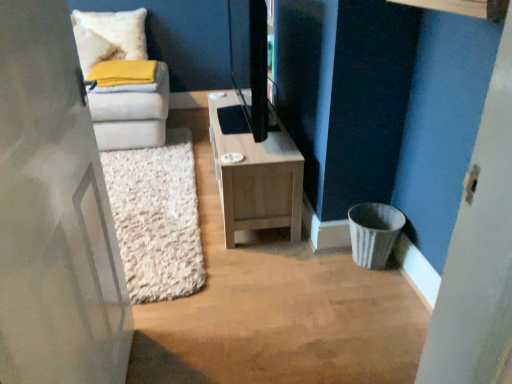
This screenshot has height=384, width=512. Describe the element at coordinates (157, 218) in the screenshot. I see `white shaggy rug at center` at that location.

Find the location of a particular element. white matte door at left is located at coordinates (54, 213).

Who is bigger, white soft pillow at upper left or white matte door at left?

white matte door at left.

Is white soft pillow at upper left not close to white matte door at left?

white soft pillow at upper left is far away from white matte door at left.

You are a GUI agent. You are given a task and a screenshot of the screen. Output one action in this format:
    pyautogui.click(x=<x>, y=<y>)
    Task: Click on the pillow lying on the left of white matte door at left
    This screenshot has height=384, width=512.
    Given the screenshot: What is the action you would take?
    pyautogui.click(x=94, y=49)

Is white soft pillow at upper left positioned with its back to white matte door at left?

No, white soft pillow at upper left is not facing away from white matte door at left.

Is light wood/texture tv stand at center taller or shorter than white shaggy rug at center?

Considering their sizes, light wood/texture tv stand at center has more height than white shaggy rug at center.

Is point (238, 150) farther from viewer compared to point (203, 262)?

Yes, it is.

Is the surface of light wood/texture tv stand at center in direct contact with white shaggy rug at center?

No, light wood/texture tv stand at center is not making contact with white shaggy rug at center.

Can you confirm if light wood/texture tv stand at center is wider than white shaggy rug at center?

In fact, light wood/texture tv stand at center might be narrower than white shaggy rug at center.

Consider the image. From a real-world perspective, does white matte door at left sit lower than white shaggy rug at center?

No, from a real-world perspective, white matte door at left is not under white shaggy rug at center.

Could you tell me if white matte door at left is turned towards white shaggy rug at center?

No, white matte door at left does not turn towards white shaggy rug at center.

Between white matte door at left and white shaggy rug at center, which one has larger width?

With larger width is white shaggy rug at center.

Locate an element on the screen. mat below the white matte door at left (from a real-world perspective) is located at coordinates (157, 218).

Can you confirm if white shaggy rug at center is wider than white soft pillow at upper left?

Indeed, white shaggy rug at center has a greater width compared to white soft pillow at upper left.

From the image's perspective, between white shaggy rug at center and white soft pillow at upper left, who is located below?

white shaggy rug at center appears lower in the image.

What's the angular difference between white shaggy rug at center and white soft pillow at upper left's facing directions?

102 degrees.

Between white shaggy rug at center and white soft pillow at upper left, which one appears on the left side from the viewer's perspective?

From the viewer's perspective, white soft pillow at upper left appears more on the left side.

From the image's perspective, is light wood/texture tv stand at center located above white matte door at left?

Indeed, from the image's perspective, light wood/texture tv stand at center is shown above white matte door at left.

From the picture: How far apart are light wood/texture tv stand at center and white matte door at left?

light wood/texture tv stand at center is 94.89 centimeters from white matte door at left.

Does light wood/texture tv stand at center have a larger size compared to white matte door at left?

Yes.

Is light wood/texture tv stand at center positioned with its back to white matte door at left?

No.

Considering the relative sizes of white matte door at left and light wood/texture tv stand at center in the image provided, is white matte door at left smaller than light wood/texture tv stand at center?

Correct, white matte door at left occupies less space than light wood/texture tv stand at center.

Does white matte door at left touch light wood/texture tv stand at center?

There is a gap between white matte door at left and light wood/texture tv stand at center.

Locate an element on the screen. Image resolution: width=512 pixels, height=384 pixels. table that appears below the white matte door at left (from a real-world perspective) is located at coordinates (254, 171).

From a real-world perspective, relative to white shaggy rug at center, is white soft pillow at upper left vertically above or below?

Clearly, from a real-world perspective, white soft pillow at upper left is above white shaggy rug at center.

Which is in front, point (92, 33) or point (164, 156)?

The point (164, 156) is in front.

Considering the relative positions of white soft pillow at upper left and white shaggy rug at center in the image provided, is white soft pillow at upper left to the left of white shaggy rug at center from the viewer's perspective?

Correct, you'll find white soft pillow at upper left to the left of white shaggy rug at center.

Is white soft pillow at upper left thinner than white shaggy rug at center?

Yes.

At what (x,y) coordinates should I click in order to perform the action: click on pillow above the white matte door at left (from the image's perspective). Please return your answer as a coordinate pair (x, y). This screenshot has width=512, height=384. Looking at the image, I should click on (94, 49).

The image size is (512, 384). Identify the location of mat in front of the light wood/texture tv stand at center. (157, 218).

Consider the image. From the image, which object appears to be nearer to white soft pillow at upper left, white shaggy rug at center or light wood/texture tv stand at center?

white shaggy rug at center.

Estimate the real-world distances between objects in this image. Which object is further from white shaggy rug at center, white matte door at left or light wood/texture tv stand at center?

Based on the image, white matte door at left appears to be further to white shaggy rug at center.

Considering their positions, is white soft pillow at upper left positioned further to white shaggy rug at center than white matte door at left?

Based on the image, white soft pillow at upper left appears to be further to white shaggy rug at center.

Based on their spatial positions, is light wood/texture tv stand at center or white matte door at left closer to white soft pillow at upper left?

light wood/texture tv stand at center lies closer to white soft pillow at upper left than the other object.

When comparing their distances from light wood/texture tv stand at center, does white shaggy rug at center or white matte door at left seem closer?

white shaggy rug at center.

Looking at this image, from the image, which object appears to be farther from light wood/texture tv stand at center, white soft pillow at upper left or white matte door at left?

The object further to light wood/texture tv stand at center is white soft pillow at upper left.

Considering their positions, is white shaggy rug at center positioned closer to white matte door at left than light wood/texture tv stand at center?

white shaggy rug at center is closer to white matte door at left.

Which object lies further to the anchor point white matte door at left, light wood/texture tv stand at center or white shaggy rug at center?

light wood/texture tv stand at center.

You are a GUI agent. You are given a task and a screenshot of the screen. Output one action in this format:
    pyautogui.click(x=<x>, y=<y>)
    Task: Click on the table between white shaggy rug at center and white soft pillow at upper left along the z-axis
    Image resolution: width=512 pixels, height=384 pixels.
    Given the screenshot: What is the action you would take?
    pyautogui.click(x=254, y=171)

This screenshot has height=384, width=512. I want to click on mat between white matte door at left and light wood/texture tv stand at center from front to back, so click(x=157, y=218).

Locate an element on the screen. The width and height of the screenshot is (512, 384). table positioned between white matte door at left and white soft pillow at upper left from near to far is located at coordinates (254, 171).

The width and height of the screenshot is (512, 384). In order to click on mat between white matte door at left and white soft pillow at upper left in the front-back direction in this screenshot , I will do `click(157, 218)`.